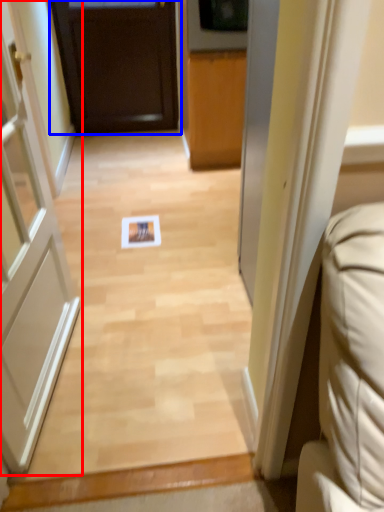
Question: Among these objects, which one is nearest to the camera, door (highlighted by a red box) or door (highlighted by a blue box)?

Choices:
 (A) door
 (B) door

Answer: (A)